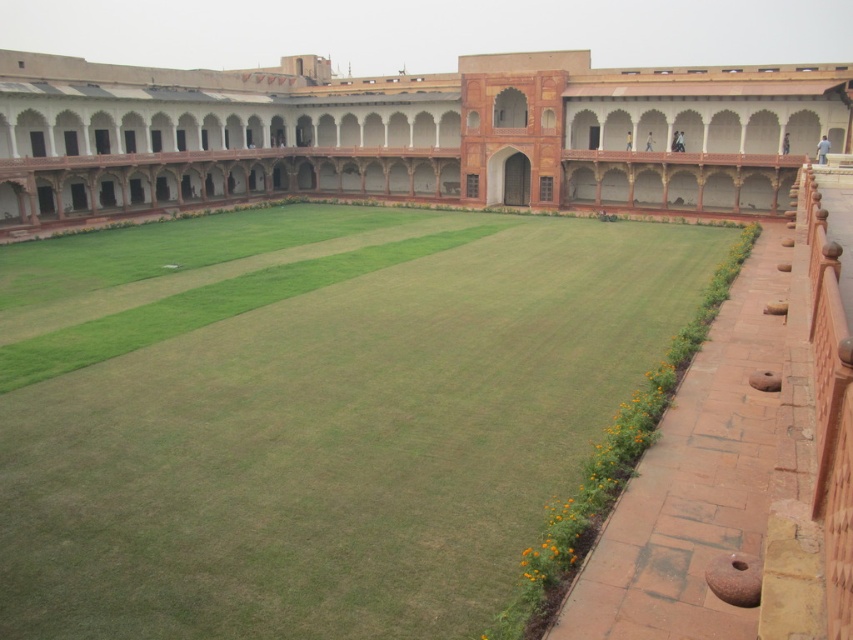
Question: Which point appears closest to the camera in this image?

Choices:
 (A) [x=85, y=189]
 (B) [x=434, y=493]

Answer: (B)

Question: Can you confirm if green grass at center is wider than terracotta stone palace at center?

Choices:
 (A) no
 (B) yes

Answer: (A)

Question: Is green grass at center bigger than terracotta stone palace at center?

Choices:
 (A) yes
 (B) no

Answer: (B)

Question: Does green grass at center appear under terracotta stone palace at center?

Choices:
 (A) yes
 (B) no

Answer: (A)